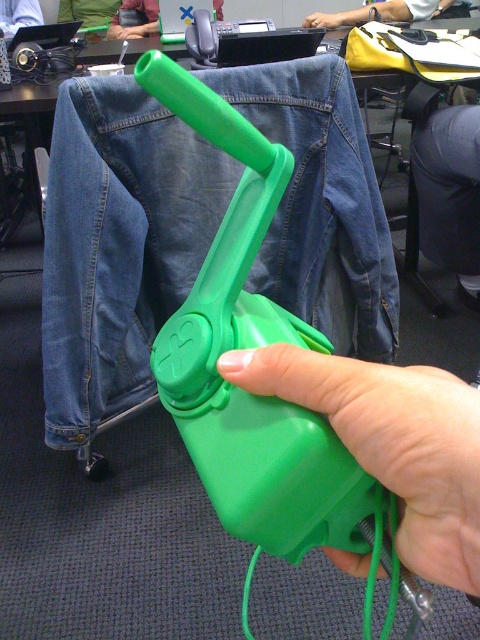
Can you confirm if green matte plastic hand at center is smaller than green plastic hand at upper center?

Yes.

Between green matte plastic hand at center and green plastic hand at upper center, which one appears on the right side from the viewer's perspective?

green plastic hand at upper center is more to the right.

Describe the element at coordinates (393, 444) in the screenshot. I see `green matte plastic hand at center` at that location.

The height and width of the screenshot is (640, 480). I want to click on green matte plastic hand at center, so click(393, 444).

Between green matte plastic hand at center and smooth yellow shirt at upper center, which one has less height?

Standing shorter between the two is green matte plastic hand at center.

Does green matte plastic hand at center come behind smooth yellow shirt at upper center?

No, green matte plastic hand at center is in front of smooth yellow shirt at upper center.

Does point (415, 400) come closer to viewer compared to point (348, 24)?

That is True.

This screenshot has height=640, width=480. Identify the location of green matte plastic hand at center. (393, 444).

Can you confirm if green matte plastic hand at center is thinner than brushed metal water at bottle left?

Yes.

Describe the element at coordinates (393, 444) in the screenshot. This screenshot has width=480, height=640. I see `green matte plastic hand at center` at that location.

Does point (410, 461) lie behind point (141, 0)?

No, it is in front of (141, 0).

This screenshot has width=480, height=640. Identify the location of green matte plastic hand at center. (393, 444).